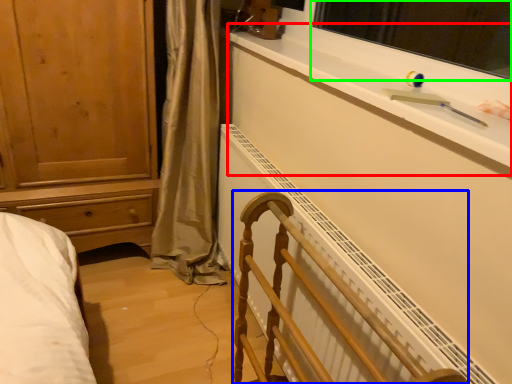
Question: Estimate the real-world distances between objects in this image. Which object is farther from window sill (highlighted by a red box), furniture (highlighted by a blue box) or window screen (highlighted by a green box)?

Choices:
 (A) furniture
 (B) window screen

Answer: (B)